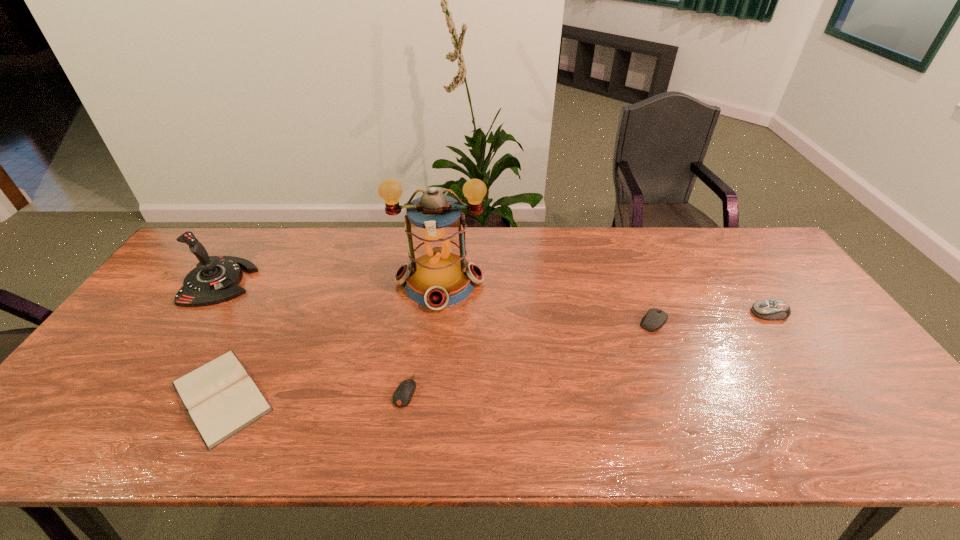
Locate an element on the screen. computer mouse that is the nearest to the nearest computer mouse is located at coordinates (655, 318).

Locate an element on the screen. computer mouse identified as the closest to the Bible is located at coordinates (403, 394).

The image size is (960, 540). I want to click on vacant space that satisfies the following two spatial constraints: 1. on the handle side of the joystick; 2. on the left side of the second object from right to left, so click(194, 322).

I want to click on free space that satisfies the following two spatial constraints: 1. on the back side of the Bible; 2. on the left side of the fifth object from left to right, so click(x=259, y=322).

Locate an element on the screen. free space that satisfies the following two spatial constraints: 1. on the back side of the shortest object; 2. on the left side of the nearest computer mouse is located at coordinates (224, 391).

I want to click on vacant space that satisfies the following two spatial constraints: 1. on the back side of the nearest computer mouse; 2. on the handle side of the fifth shortest object, so 421,282.

The image size is (960, 540). Identify the location of free space that satisfies the following two spatial constraints: 1. on the front-facing side of the second object from right to left; 2. on the right side of the lantern. (436, 322).

Locate an element on the screen. vacant space that satisfies the following two spatial constraints: 1. on the back side of the Bible; 2. on the right side of the second computer mouse from left to right is located at coordinates (259, 322).

Where is `free space that satisfies the following two spatial constraints: 1. on the front-facing side of the tallest object; 2. on the right side of the second computer mouse from left to right`? This screenshot has height=540, width=960. free space that satisfies the following two spatial constraints: 1. on the front-facing side of the tallest object; 2. on the right side of the second computer mouse from left to right is located at coordinates (436, 322).

This screenshot has width=960, height=540. What are the coordinates of `vacant space that satisfies the following two spatial constraints: 1. on the back side of the shortest object; 2. on the right side of the leftmost computer mouse` in the screenshot? It's located at (224, 391).